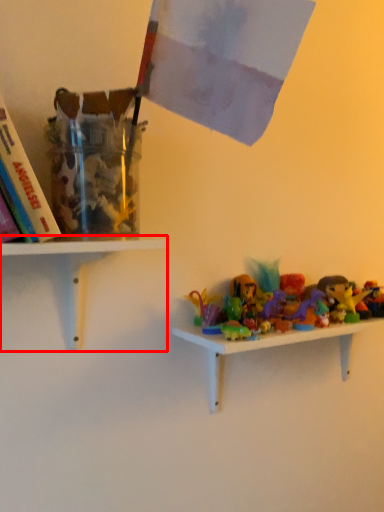
Question: From the image's perspective, where is shelf (annotated by the red box) located relative to shelf?

Choices:
 (A) above
 (B) below

Answer: (A)